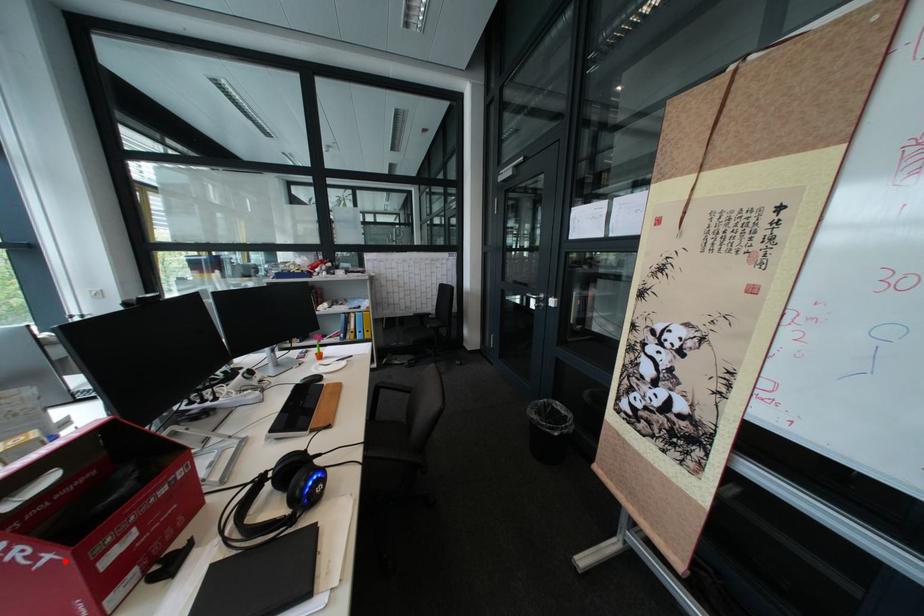
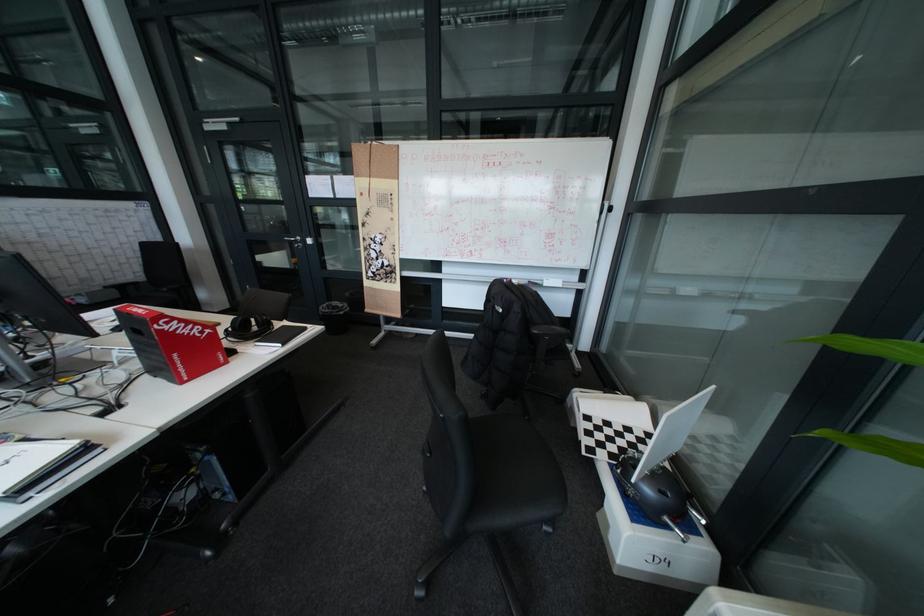
Question: I am providing you with two images of the same scene from different viewpoints. Image1 has a red point marked. In image2, the corresponding 3D location appears at what relative position? Reply with the corresponding letter.

Choices:
 (A) Closer
 (B) Farther

Answer: (B)